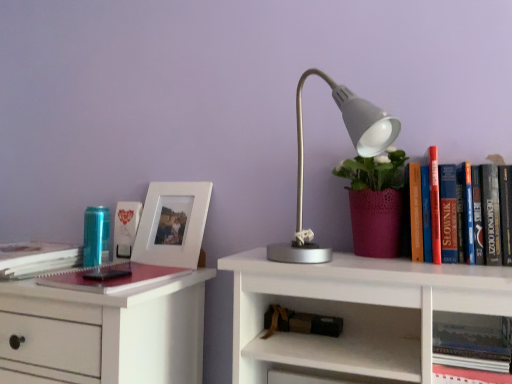
In order to face white matte picture frame at left, should I rotate leftwards or rightwards?

You should rotate left by 10.963 degrees.

What do you see at coordinates (35, 253) in the screenshot? This screenshot has width=512, height=384. I see `hardcover book at left, positioned as the fourth book in bottom-to-top order` at bounding box center [35, 253].

You are a GUI agent. You are given a task and a screenshot of the screen. Output one action in this format:
    pyautogui.click(x=<x>, y=<y>)
    Task: Click on the white matte picture frame at left
    This screenshot has height=384, width=512.
    Given the screenshot: What is the action you would take?
    pyautogui.click(x=172, y=224)

Considering the positions of points (133, 202) and (350, 130), is point (133, 202) farther from camera compared to point (350, 130)?

Yes, it is behind point (350, 130).

Could you measure the distance between matte white photo frame at left, which ranks as the 2th book in left-to-right order, and matte gray lamp at center?

matte white photo frame at left, which ranks as the 2th book in left-to-right order, is 23.33 inches away from matte gray lamp at center.

From the image's perspective, between matte white photo frame at left, acting as the first book starting from the top, and matte gray lamp at center, who is located below?

matte white photo frame at left, acting as the first book starting from the top, is shown below in the image.

Would you say matte white photo frame at left, positioned as the fourth book in right-to-left order, is to the left or to the right of matte gray lamp at center in the picture?

From the image, it's evident that matte white photo frame at left, positioned as the fourth book in right-to-left order, is to the left of matte gray lamp at center.

Locate an element on the screen. The height and width of the screenshot is (384, 512). the 1st book located above the brown leather book at lower center, marked as the 2th book in a bottom-to-top arrangement (from a real-world perspective) is located at coordinates (111, 277).

Is matte red notebook at left, which appears as the 3th book when viewed from the left, wider or thinner than brown leather book at lower center, positioned as the second book in right-to-left order?

matte red notebook at left, which appears as the 3th book when viewed from the left, is wider than brown leather book at lower center, positioned as the second book in right-to-left order.

Is matte red notebook at left, which is the 3th book in top-to-bottom order, facing towards brown leather book at lower center, positioned as the second book in right-to-left order?

No, matte red notebook at left, which is the 3th book in top-to-bottom order, is not turned towards brown leather book at lower center, positioned as the second book in right-to-left order.

Is matte red notebook at left, which appears as the 3th book when viewed from the left, surrounding brown leather book at lower center, positioned as the second book in right-to-left order?

No, brown leather book at lower center, positioned as the second book in right-to-left order, is not inside matte red notebook at left, which appears as the 3th book when viewed from the left.

Image resolution: width=512 pixels, height=384 pixels. Find the location of `lamp that is on the right side of white matte picture frame at left`. lamp that is on the right side of white matte picture frame at left is located at coordinates (356, 150).

Considering the sizes of objects matte gray lamp at center and white matte picture frame at left in the image provided, who is wider, matte gray lamp at center or white matte picture frame at left?

With larger width is matte gray lamp at center.

From a real-world perspective, is matte gray lamp at center above or below white matte picture frame at left?

matte gray lamp at center is situated higher than white matte picture frame at left in the real world.

Could you tell me if matte gray lamp at center is facing white matte picture frame at left?

No, matte gray lamp at center is not turned towards white matte picture frame at left.

Which object is more forward, white matte picture frame at left or matte gray lamp at center?

matte gray lamp at center.

Is white matte picture frame at left not inside matte gray lamp at center?

Indeed, white matte picture frame at left is completely outside matte gray lamp at center.

Could you tell me if white matte picture frame at left is turned towards matte gray lamp at center?

No, white matte picture frame at left does not turn towards matte gray lamp at center.

Considering the relative sizes of white matte picture frame at left and matte gray lamp at center in the image provided, is white matte picture frame at left wider than matte gray lamp at center?

In fact, white matte picture frame at left might be narrower than matte gray lamp at center.

Is white matte picture frame at left bigger than hardcover book at upper right, which is counted as the first book, starting from the right?

Indeed, white matte picture frame at left has a larger size compared to hardcover book at upper right, which is counted as the first book, starting from the right.

Which is behind, point (205, 207) or point (437, 363)?

The point (205, 207) is farther.

In the scene shown: Can hardcover book at upper right, which is counted as the first book, starting from the right, be found inside white matte picture frame at left?

Actually, hardcover book at upper right, which is counted as the first book, starting from the right, is outside white matte picture frame at left.

Is point (318, 331) positioned before point (21, 263)?

Yes, it is in front of point (21, 263).

Based on the photo, which object is closer to the camera taking this photo, brown leather book at lower center, positioned as the second book in right-to-left order, or hardcover book at left, which ranks as the second book in top-to-bottom order?

→ Positioned in front is hardcover book at left, which ranks as the second book in top-to-bottom order.

From the image's perspective, is brown leather book at lower center, marked as the 2th book in a bottom-to-top arrangement, positioned above or below hardcover book at left, the fifth book positioned from the right?

brown leather book at lower center, marked as the 2th book in a bottom-to-top arrangement, is below hardcover book at left, the fifth book positioned from the right.

Considering the sizes of objects brown leather book at lower center, positioned as the 4th book in top-to-bottom order, and hardcover book at left, which appears as the 1th book when viewed from the left, in the image provided, who is thinner, brown leather book at lower center, positioned as the 4th book in top-to-bottom order, or hardcover book at left, which appears as the 1th book when viewed from the left,?

brown leather book at lower center, positioned as the 4th book in top-to-bottom order.

Looking at this image, which point is more distant from viewer, [367,110] or [138,220]?

The point [138,220] is behind.

From the image's perspective, would you say matte gray lamp at center is positioned over matte white photo frame at left, marked as the 5th book in a bottom-to-top arrangement?

Correct, matte gray lamp at center appears higher than matte white photo frame at left, marked as the 5th book in a bottom-to-top arrangement, in the image.

Is matte gray lamp at center oriented towards matte white photo frame at left, positioned as the fourth book in right-to-left order?

No, matte gray lamp at center does not turn towards matte white photo frame at left, positioned as the fourth book in right-to-left order.

From the picture: From a real-world perspective, is matte gray lamp at center positioned above or below matte white photo frame at left, acting as the first book starting from the top?

From a real-world perspective, matte gray lamp at center is physically above matte white photo frame at left, acting as the first book starting from the top.

From a real-world perspective, count 1st books downward from the matte gray lamp at center and point to it. Please provide its 2D coordinates.

[(125, 228)]

This screenshot has height=384, width=512. I want to click on book that is the 2nd one when counting forward from the brown leather book at lower center, positioned as the 4th book in top-to-bottom order, so click(x=111, y=277).

Estimate the real-world distances between objects in this image. Which object is closer to matte gray lamp at center, matte red notebook at left, which appears as the 3th book when viewed from the left, or hardcover book at upper right, the fifth book when ordered from left to right?

Among the two, hardcover book at upper right, the fifth book when ordered from left to right, is located nearer to matte gray lamp at center.

Considering their positions, is matte red notebook at left, which is the 3th book in bottom-to-top order, positioned further to matte white photo frame at left, marked as the 5th book in a bottom-to-top arrangement, than hardcover book at upper right, which is the 1th book from bottom to top?

hardcover book at upper right, which is the 1th book from bottom to top, lies further to matte white photo frame at left, marked as the 5th book in a bottom-to-top arrangement, than the other object.

Which object lies further to the anchor point hardcover book at upper right, which ranks as the fifth book in top-to-bottom order, matte gray lamp at center or hardcover book at left, positioned as the fourth book in bottom-to-top order?

hardcover book at left, positioned as the fourth book in bottom-to-top order, is positioned further to the anchor hardcover book at upper right, which ranks as the fifth book in top-to-bottom order.

From the image, which object appears to be nearer to hardcover book at upper right, the fifth book when ordered from left to right, hardcover book at left, which appears as the 1th book when viewed from the left, or brown leather book at lower center, positioned as the second book in right-to-left order?

Among the two, brown leather book at lower center, positioned as the second book in right-to-left order, is located nearer to hardcover book at upper right, the fifth book when ordered from left to right.

Considering their positions, is matte red notebook at left, which is the 3th book in bottom-to-top order, positioned further to brown leather book at lower center, which ranks as the 4th book in left-to-right order, than white matte picture frame at left?

white matte picture frame at left lies further to brown leather book at lower center, which ranks as the 4th book in left-to-right order, than the other object.

Based on their spatial positions, is hardcover book at left, which appears as the 1th book when viewed from the left, or matte gray lamp at center further from brown leather book at lower center, positioned as the second book in right-to-left order?

hardcover book at left, which appears as the 1th book when viewed from the left, lies further to brown leather book at lower center, positioned as the second book in right-to-left order, than the other object.

Considering their positions, is white matte picture frame at left positioned closer to matte gray lamp at center than matte red notebook at left, which appears as the 3th book when viewed from the left?

Among the two, white matte picture frame at left is located nearer to matte gray lamp at center.

Based on their spatial positions, is hardcover book at upper right, which is counted as the first book, starting from the right, or brown leather book at lower center, positioned as the 4th book in top-to-bottom order, closer to matte white photo frame at left, marked as the 5th book in a bottom-to-top arrangement?

The object closer to matte white photo frame at left, marked as the 5th book in a bottom-to-top arrangement, is brown leather book at lower center, positioned as the 4th book in top-to-bottom order.

Image resolution: width=512 pixels, height=384 pixels. I want to click on picture frame between matte red notebook at left, marked as the 3th book in a right-to-left arrangement, and hardcover book at upper right, which is the 1th book from bottom to top, so click(x=172, y=224).

At what (x,y) coordinates should I click in order to perform the action: click on lamp between hardcover book at left, the fifth book positioned from the right, and hardcover book at upper right, which ranks as the fifth book in top-to-bottom order, in the horizontal direction. Please return your answer as a coordinate pair (x, y). The width and height of the screenshot is (512, 384). Looking at the image, I should click on (356, 150).

I want to click on book between matte red notebook at left, which appears as the 3th book when viewed from the left, and matte gray lamp at center, so [x=300, y=322].

Locate an element on the screen. picture frame between matte red notebook at left, which appears as the 3th book when viewed from the left, and matte white photo frame at left, which ranks as the 2th book in left-to-right order, along the z-axis is located at coordinates (172, 224).